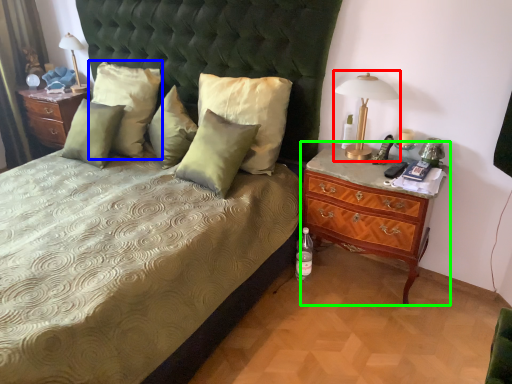
Question: Which object is positioned closest to bedside lamp (highlighted by a red box)? Select from pillow (highlighted by a blue box) and nightstand (highlighted by a green box).

Choices:
 (A) pillow
 (B) nightstand

Answer: (B)